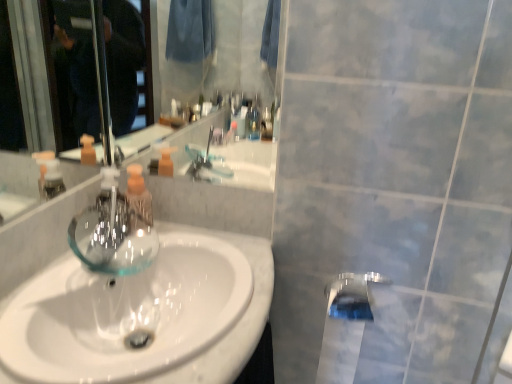
Question: Is clear glass faucet at center in front of or behind white glossy sink at center in the image?

Choices:
 (A) front
 (B) behind

Answer: (B)

Question: From their relative heights in the image, would you say clear glass faucet at center is taller or shorter than white glossy sink at center?

Choices:
 (A) short
 (B) tall

Answer: (B)

Question: Which object is the closest to the clear glass bottle at center?

Choices:
 (A) white glossy sink at center
 (B) chrome metallic tap at lower center
 (C) clear glass faucet at center

Answer: (C)

Question: Which object is the closest to the white glossy sink at center?

Choices:
 (A) clear glass bottle at center
 (B) clear glass faucet at center
 (C) chrome metallic tap at lower center

Answer: (B)